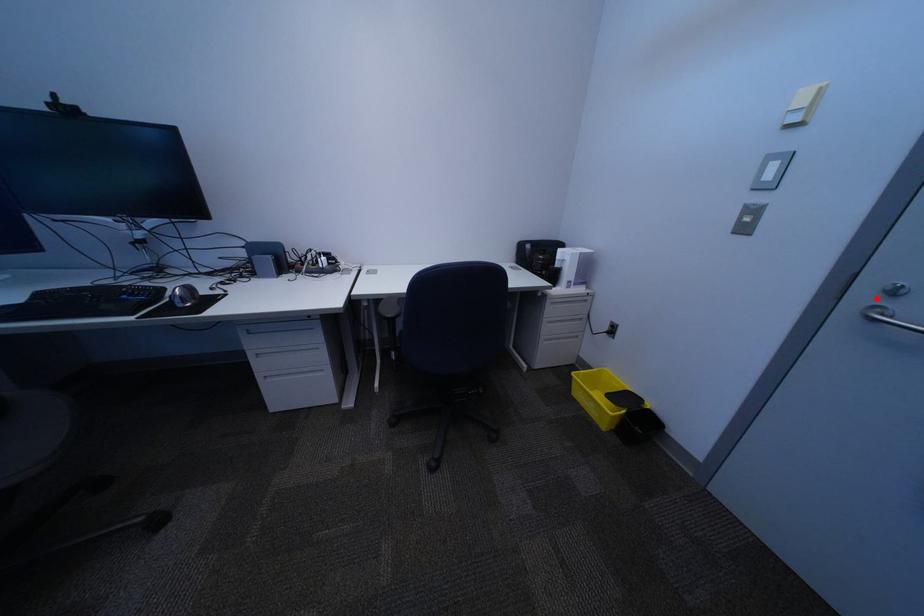
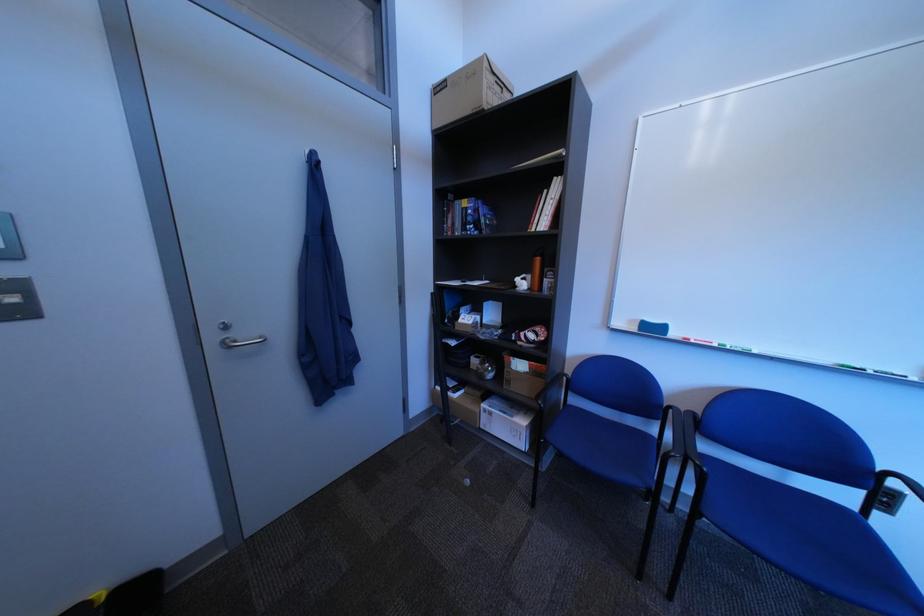
The point at the highlighted location is marked in the first image. Where is the corresponding point in the second image?

(226, 339)